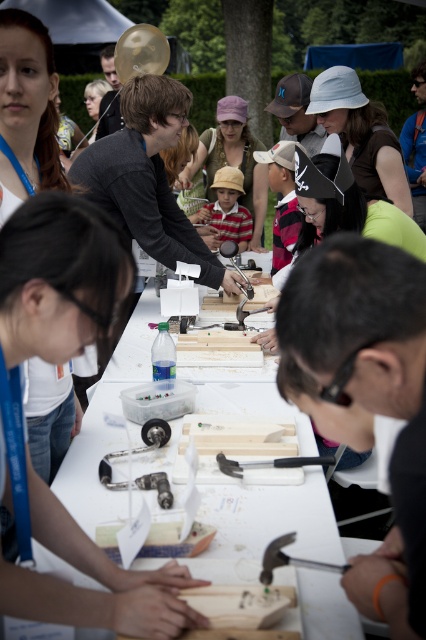
In the scene shown: Who is positioned more to the left, white wood table at center or metallic hammer at center?

white wood table at center is more to the left.

Measure the distance between white wood table at center and metallic hammer at center.

They are 13.86 inches apart.

Who is more forward, (331, 544) or (282, 461)?

Positioned in front is point (331, 544).

Locate an element on the screen. The height and width of the screenshot is (640, 426). white wood table at center is located at coordinates (271, 518).

Is white wood table at center bigger than metallic gray drill at lower left?

Correct, white wood table at center is larger in size than metallic gray drill at lower left.

Locate an element on the screen. This screenshot has height=640, width=426. white wood table at center is located at coordinates (271, 518).

Is point (95, 515) positioned after point (167, 499)?

No, it is in front of (167, 499).

The image size is (426, 640). In order to click on white wood table at center in this screenshot , I will do `click(271, 518)`.

The height and width of the screenshot is (640, 426). What do you see at coordinates (58, 278) in the screenshot?
I see `matte white shirt at center` at bounding box center [58, 278].

Describe the element at coordinates (58, 278) in the screenshot. Image resolution: width=426 pixels, height=640 pixels. I see `matte white shirt at center` at that location.

This screenshot has height=640, width=426. Identify the location of matte white shirt at center. tap(58, 278).